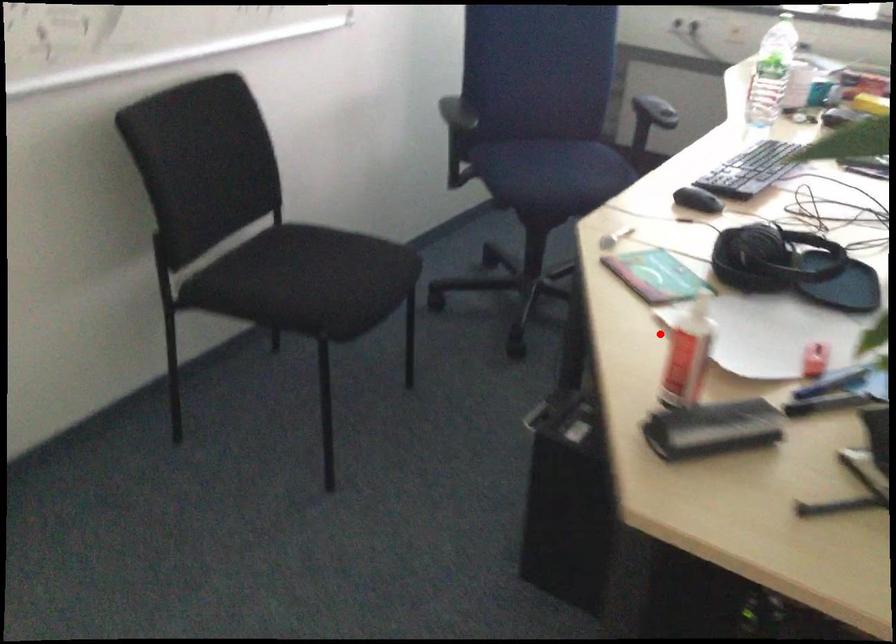
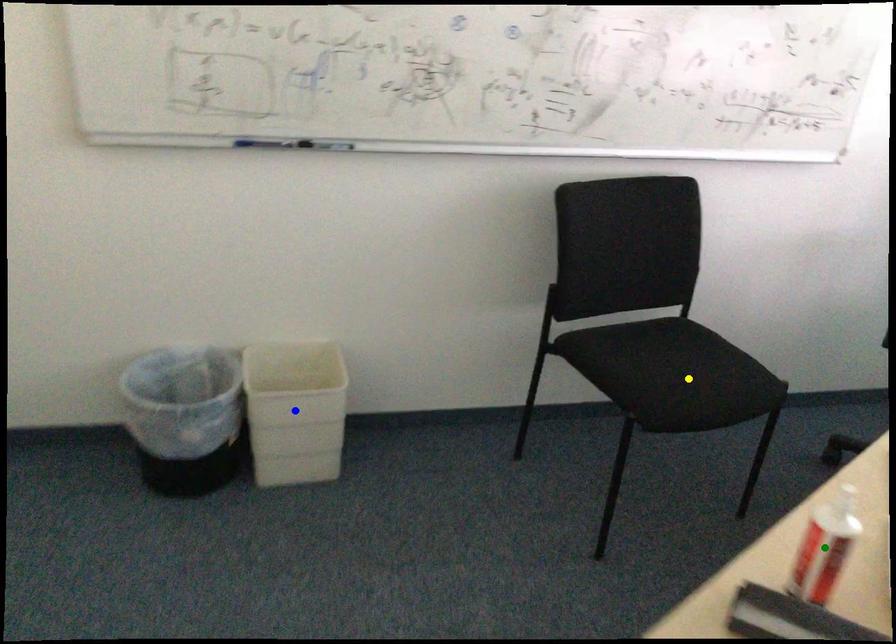
Question: I am providing you with two images of the same scene from different viewpoints. A red point is marked on the first image. You are given multiple points on the second image. Which point in image 2 is actually the same real-world point as the red point in image 1?

Choices:
 (A) blue point
 (B) green point
 (C) yellow point

Answer: (B)